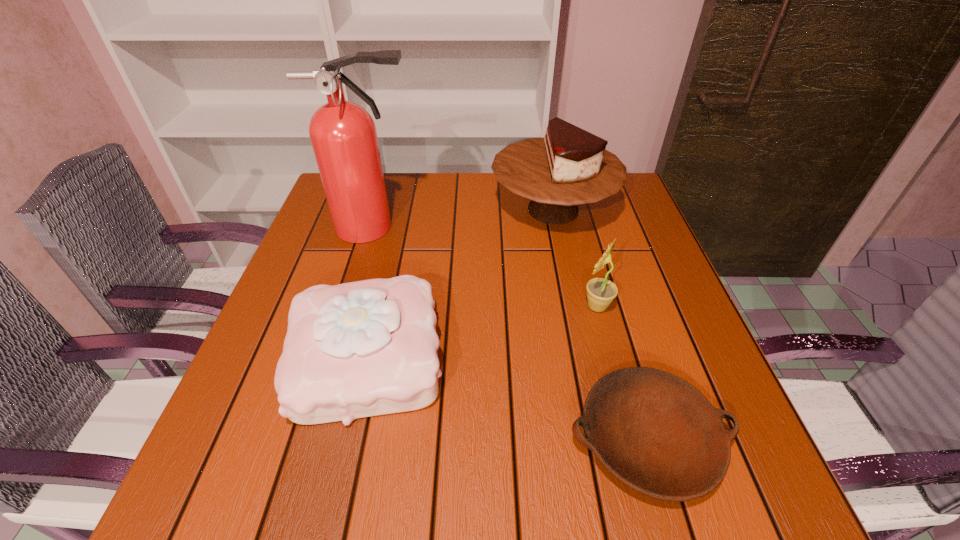
At what (x,y) coordinates should I click in order to perform the action: click on vacant position located on the face of the sunflower. Please return your answer as a coordinate pair (x, y). Image resolution: width=960 pixels, height=540 pixels. Looking at the image, I should click on (535, 306).

In order to click on vacant point located on the face of the sunflower in this screenshot , I will do `click(461, 306)`.

What are the coordinates of `blank space located 0.090m on the right of the second shortest object` in the screenshot? It's located at (492, 357).

Where is `vacant area located on the left of the plate`? This screenshot has width=960, height=540. vacant area located on the left of the plate is located at coordinates (345, 440).

Locate an element on the screen. fire extinguisher at the far edge is located at coordinates (343, 134).

Image resolution: width=960 pixels, height=540 pixels. Identify the location of cake that is at the far edge. pos(569,166).

Identify the location of object situated at the near edge. (655, 432).

Image resolution: width=960 pixels, height=540 pixels. Find the location of `fire extinguisher at the left edge`. fire extinguisher at the left edge is located at coordinates pos(343,134).

I want to click on cake present at the left edge, so click(x=365, y=348).

The image size is (960, 540). What are the coordinates of `cake situated at the right edge` in the screenshot? It's located at (569, 166).